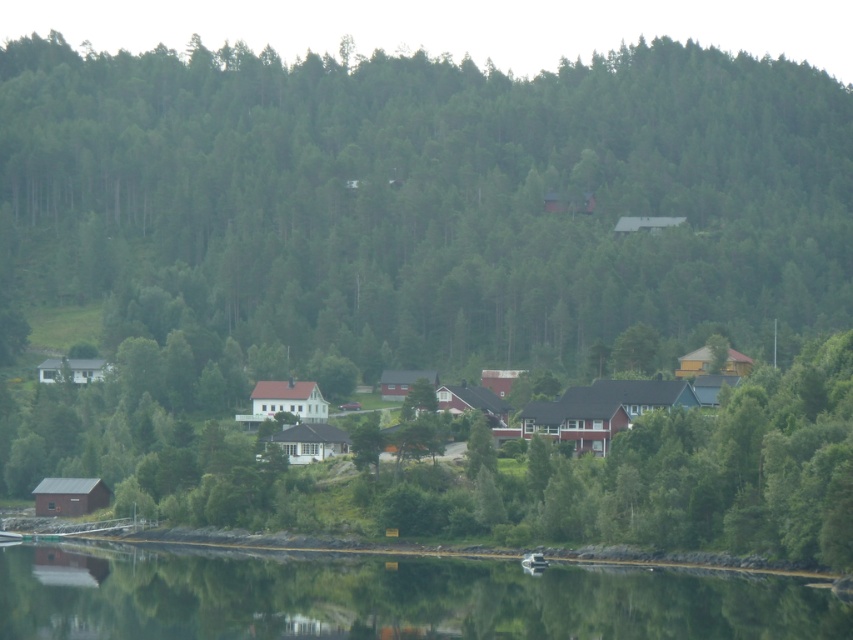
Is green matte tree at center below white matte house at center?

No, green matte tree at center is not below white matte house at center.

Does green matte tree at center have a lesser height compared to white matte house at center?

No, green matte tree at center is not shorter than white matte house at center.

Between point (512, 173) and point (680, 397), which one is positioned behind?

Point (512, 173)

Locate an element on the screen. Image resolution: width=853 pixels, height=640 pixels. green matte tree at center is located at coordinates (428, 196).

Which is below, green matte tree at center or transparent water at lower center?

transparent water at lower center

Is green matte tree at center to the right of transparent water at lower center from the viewer's perspective?

Correct, you'll find green matte tree at center to the right of transparent water at lower center.

Does point (747, 292) come behind point (486, 593)?

That is True.

Where is `green matte tree at center`? green matte tree at center is located at coordinates (428, 196).

Is transparent water at lower center taller than white matte house at center?

Incorrect, transparent water at lower center's height is not larger of white matte house at center's.

Measure the distance between point (x=193, y=612) and camera.

Point (x=193, y=612) and camera are 464.31 feet apart from each other.

Where is `transparent water at lower center`? This screenshot has height=640, width=853. transparent water at lower center is located at coordinates (389, 598).